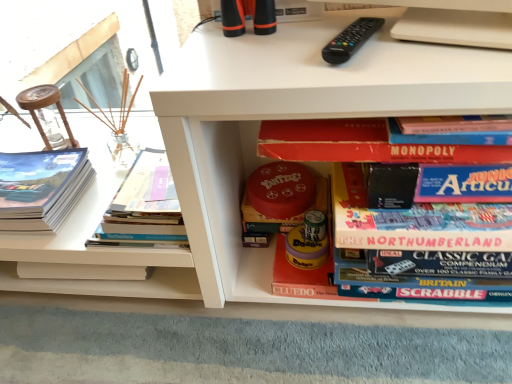
Find the location of a particular element. This screenshot has height=384, width=512. free space behind black plastic remote at upper center is located at coordinates (317, 26).